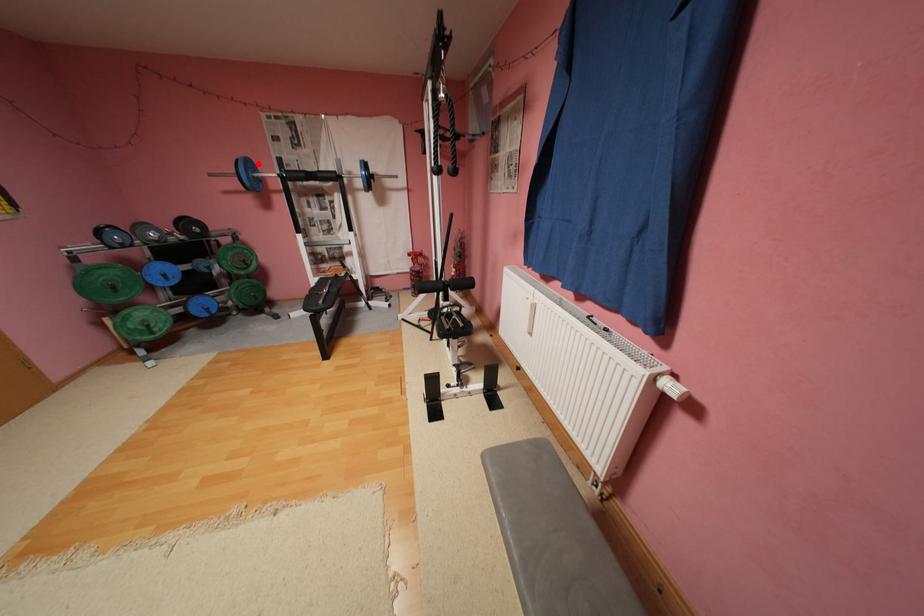
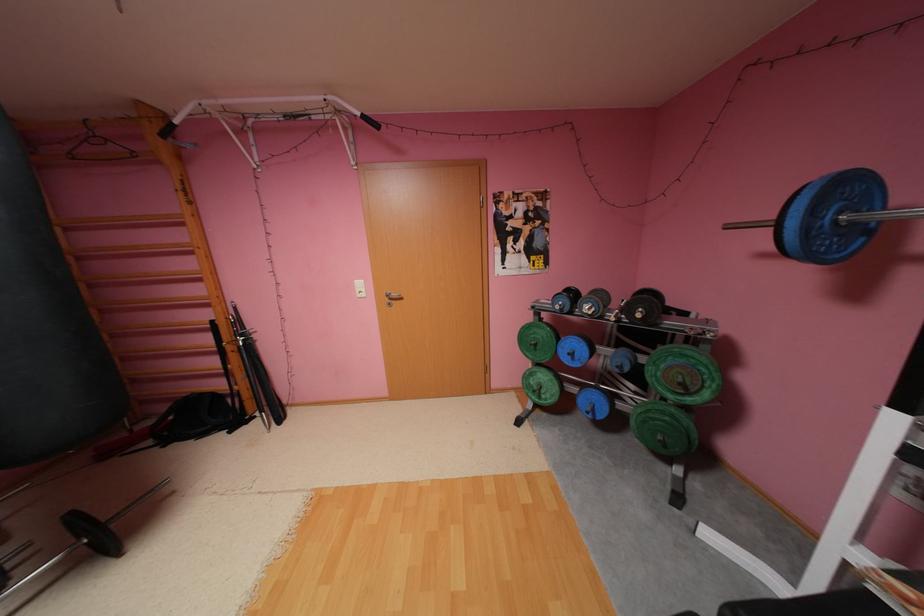
Question: I am providing you with two images of the same scene from different viewpoints. In image1, a red point is highlighted. Considering the same 3D point in image2, which of the following is correct?

Choices:
 (A) It is closer
 (B) It is farther

Answer: (B)